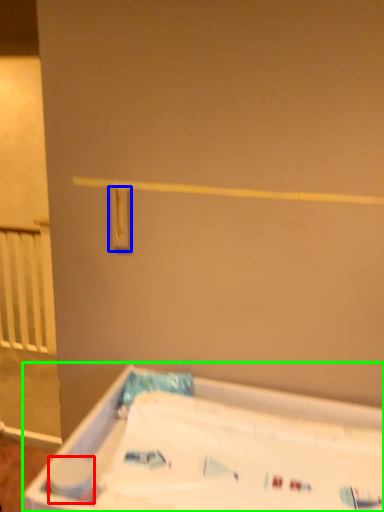
Question: Considering the real-world distances, which object is closest to toilet paper (highlighted by a red box)? light switch (highlighted by a blue box) or bathtub (highlighted by a green box).

Choices:
 (A) light switch
 (B) bathtub

Answer: (B)